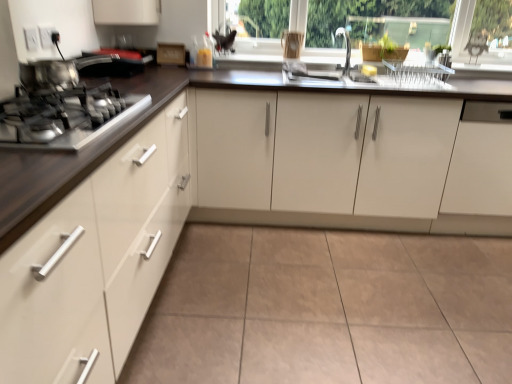
Question: In terms of size, does metallic silver pot at left appear bigger or smaller than metallic silver gas stove at left?

Choices:
 (A) small
 (B) big

Answer: (A)

Question: Is metallic silver pot at left wider or thinner than metallic silver gas stove at left?

Choices:
 (A) wide
 (B) thin

Answer: (B)

Question: Which object is positioned closest to the matte white cabinet at left, the 1th cabinetry from the left?

Choices:
 (A) white glossy cabinets at center, which is the 2th cabinetry from left to right
 (B) metallic silver pot at left
 (C) white matte cabinet at right, positioned as the 1th cabinetry in right-to-left order
 (D) metallic silver gas stove at left
 (E) transparent glass window frame at upper center

Answer: (D)

Question: Based on their relative distances, which object is nearer to the matte white cabinet at left, the 1th cabinetry from the left?

Choices:
 (A) metallic silver gas stove at left
 (B) white matte cabinet at right, which is counted as the third cabinetry, starting from the left
 (C) white glossy cabinets at center, which is counted as the second cabinetry, starting from the right
 (D) metallic silver pot at left
 (E) transparent glass window frame at upper center

Answer: (A)